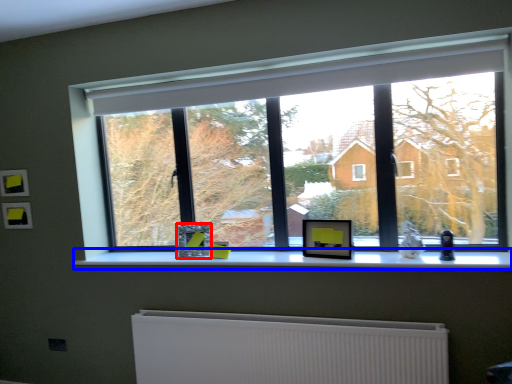
Question: Which of the following is the closest to the observer, picture frame (highlighted by a red box) or window sill (highlighted by a blue box)?

Choices:
 (A) picture frame
 (B) window sill

Answer: (B)